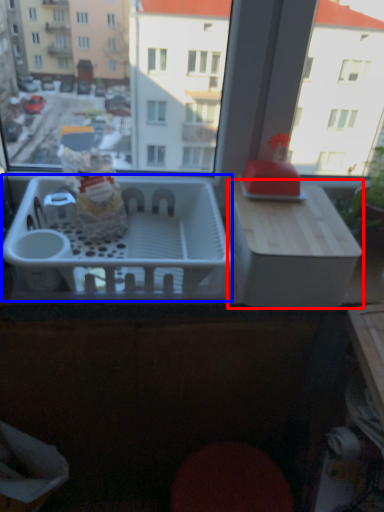
Question: Which point is closer to the camera, cardboard box (highlighted by a red box) or basket (highlighted by a blue box)?

Choices:
 (A) cardboard box
 (B) basket

Answer: (B)